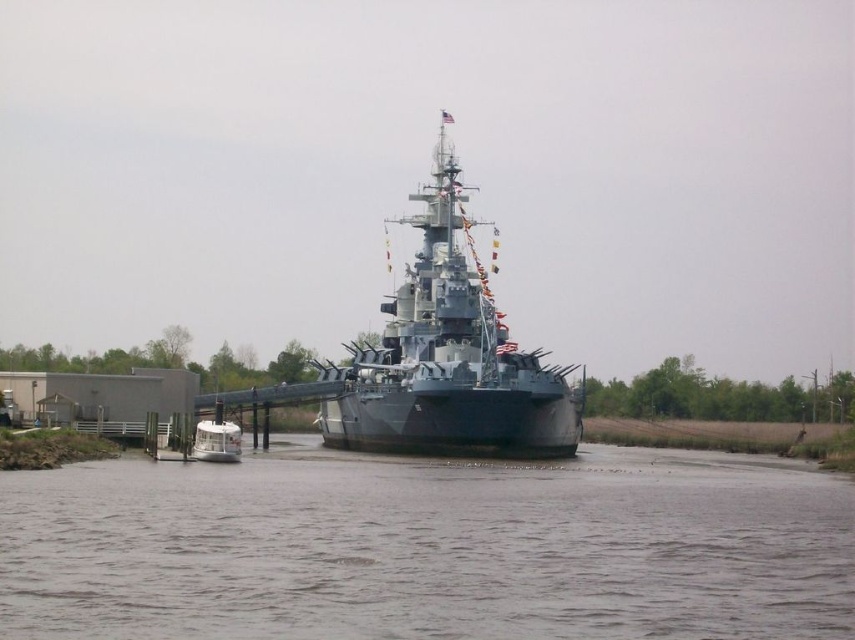
Can you confirm if gray water at center is thinner than gray metallic battleship at center?

In fact, gray water at center might be wider than gray metallic battleship at center.

Which is more to the right, gray water at center or gray metallic battleship at center?

From the viewer's perspective, gray water at center appears more on the right side.

Who is more forward, (544,477) or (494,364)?

Positioned in front is point (544,477).

You are a GUI agent. You are given a task and a screenshot of the screen. Output one action in this format:
    pyautogui.click(x=<x>, y=<y>)
    Task: Click on the gray water at center
    The width and height of the screenshot is (855, 640).
    Given the screenshot: What is the action you would take?
    pyautogui.click(x=428, y=547)